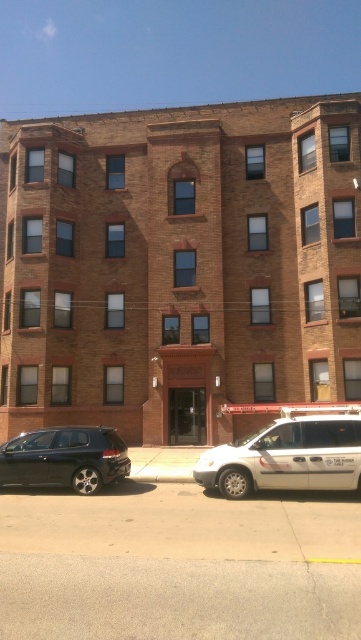
You are standing on the sidewalk in front of the apartment building and see the white matte van at center and the shiny black sedan at lower left. Which vehicle is positioned to the right of the other?

The white matte van at center is positioned to the right of the shiny black sedan at lower left.

You are standing on the sidewalk in front of the apartment building and see two points marked on the ground. One is at point (238, 477) and the other at point (75, 476). Which point is closer to the entrance of the building?

Point (238, 477) is in front of point (75, 476), so it is closer to the entrance of the apartment building.